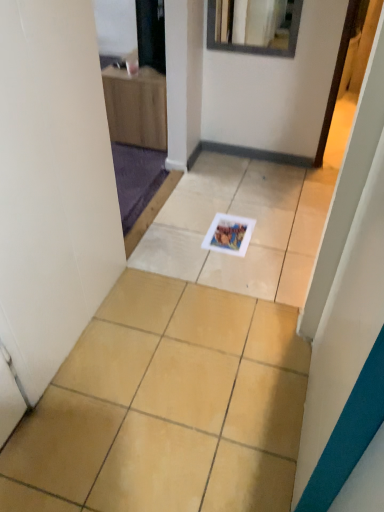
Find the location of a particular element. The width and height of the screenshot is (384, 512). empty space that is ontop of white glossy magazine at center (from a real-world perspective) is located at coordinates (233, 233).